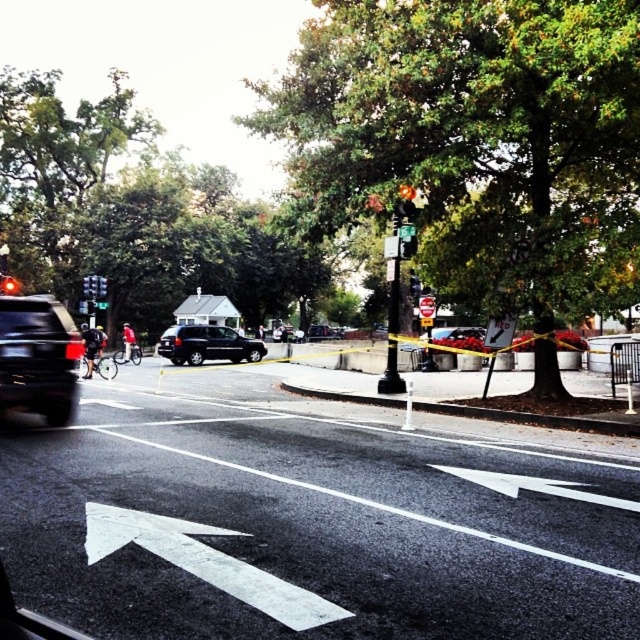
Question: Where is metallic silver car at center located in relation to red matte bicycle at left in the image?

Choices:
 (A) above
 (B) below

Answer: (A)

Question: Can you confirm if metallic silver car at center is positioned to the right of red matte bicycle at left?

Choices:
 (A) yes
 (B) no

Answer: (A)

Question: Based on their relative distances, which object is farther from the black matte bicycle at left?

Choices:
 (A) metallic silver car at center
 (B) matte black suv at left

Answer: (A)

Question: Which of the following is the closest to the observer?

Choices:
 (A) (173, 362)
 (B) (29, 310)
 (C) (484, 332)

Answer: (B)

Question: Is matte black suv at left wider than metallic silver car at center?

Choices:
 (A) no
 (B) yes

Answer: (A)

Question: Which object appears closest to the camera in this image?

Choices:
 (A) metallic silver car at center
 (B) matte black suv at left
 (C) black matte bicycle at left
 (D) black matte suv at center

Answer: (B)